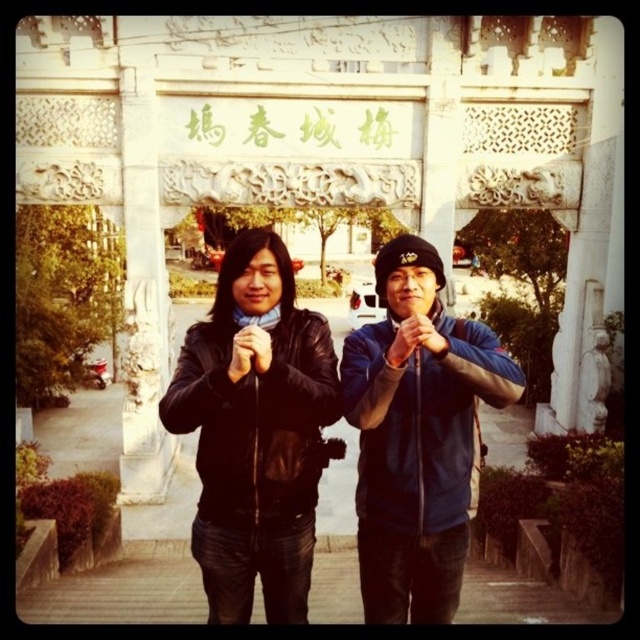
You are a photographer trying to capture a clear shot of the archway. You notice two people in front of it wearing jackets. The black leather jacket at center and the blue fabric jacket at center are blocking your view. Which jacket do you need to ask to move so that the other can stay and you can still have a clear shot?

The black leather jacket at center is in front of the blue fabric jacket at center. To get a clear shot, you should ask the black leather jacket at center to move since it is blocking the view, while the blue fabric jacket at center can remain as it is further back.

You are a tour guide who needs to ensure visitors maintain a safe distance of 5 meters apart for a group photo. You see two tourists wearing the black leather jacket at center and the blue fabric jacket at center. Can they safely stand together without violating the distance requirement?

The black leather jacket at center and blue fabric jacket at center are 5.13 meters apart, which exceeds the required 5 meters distance. Therefore, they are maintaining a safe distance and can safely stand together without violating the requirement.

You are standing in front of a traditional Chinese archway with two people nearby. You want to take a photo that includes both the archway and the person at point (339, 396). Since the person is 31.82 meters away from you, will you need to zoom in or zoom out to include both in the frame?

The person at point (339, 396) is 31.82 meters away from the viewer. To include both the archway and the person in the frame, you would need to zoom out to capture the wider view necessary to include both subjects at such a distance.